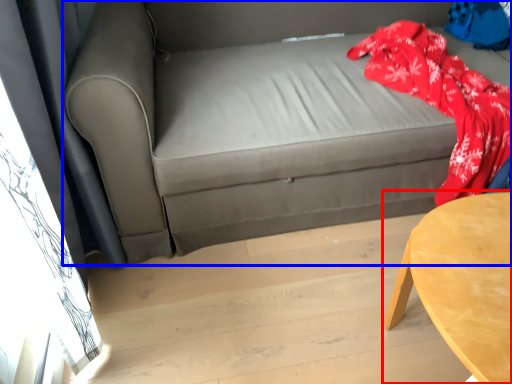
Question: Which point is closer to the camera, table (highlighted by a red box) or studio couch (highlighted by a blue box)?

Choices:
 (A) table
 (B) studio couch

Answer: (A)